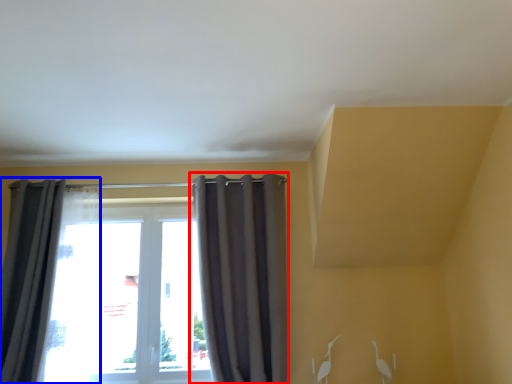
Question: Which of the following is the closest to the observer, curtain (highlighted by a red box) or curtain (highlighted by a blue box)?

Choices:
 (A) curtain
 (B) curtain

Answer: (B)